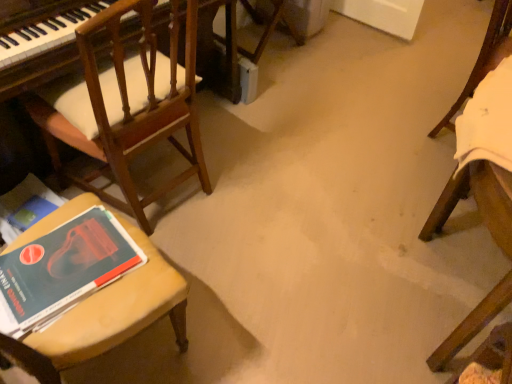
Where is `vacant space positioned to the left of white fabric chair at right, the second chair positioned from the left`? Image resolution: width=512 pixels, height=384 pixels. vacant space positioned to the left of white fabric chair at right, the second chair positioned from the left is located at coordinates (391, 126).